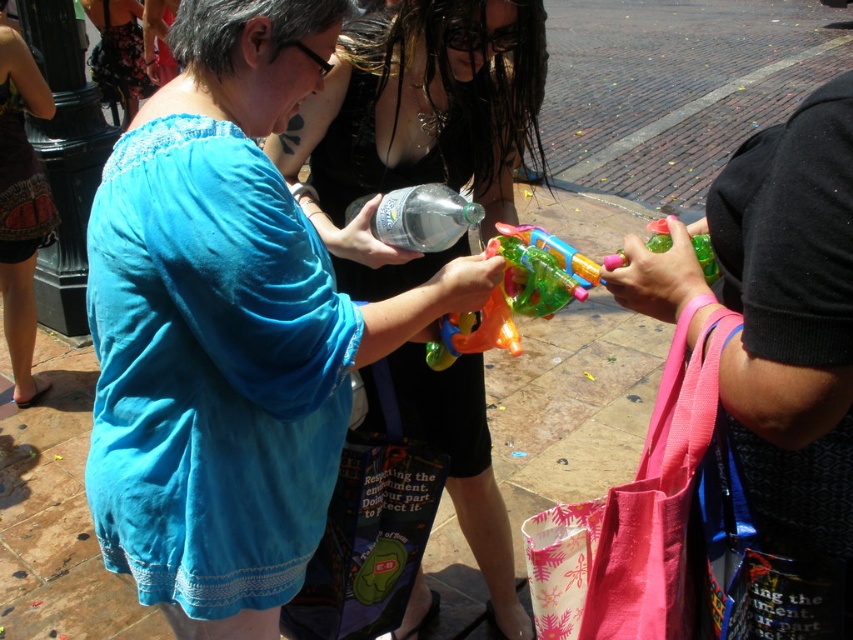
Is point (466, 150) farther from viewer compared to point (799, 445)?

Yes, it is behind point (799, 445).

Based on the photo, is matte blue shirt at center taller than pink fabric bag at right?

Correct, matte blue shirt at center is much taller as pink fabric bag at right.

Consider the image. Who is more distant from viewer, (347, 86) or (839, 516)?

The point (347, 86) is more distant.

Where is `matte blue shirt at center`? The width and height of the screenshot is (853, 640). matte blue shirt at center is located at coordinates (416, 125).

Which is below, pink fabric bag at right or translucent plastic water gun at center?

pink fabric bag at right is lower down.

Is pink fabric bag at right wider than translucent plastic water gun at center?

Correct, the width of pink fabric bag at right exceeds that of translucent plastic water gun at center.

Which is in front, point (795, 230) or point (505, 348)?

Positioned in front is point (795, 230).

Find the location of a particular element. pink fabric bag at right is located at coordinates (779, 323).

Is matte blue shirt at center taller than translucent plastic water gun at center?

Yes.

Does matte blue shirt at center have a lesser height compared to translucent plastic water gun at center?

No.

The image size is (853, 640). I want to click on matte blue shirt at center, so click(416, 125).

You are a GUI agent. You are given a task and a screenshot of the screen. Output one action in this format:
    pyautogui.click(x=<x>, y=<y>)
    Task: Click on the matte blue shirt at center
    This screenshot has height=640, width=853.
    Given the screenshot: What is the action you would take?
    pyautogui.click(x=416, y=125)